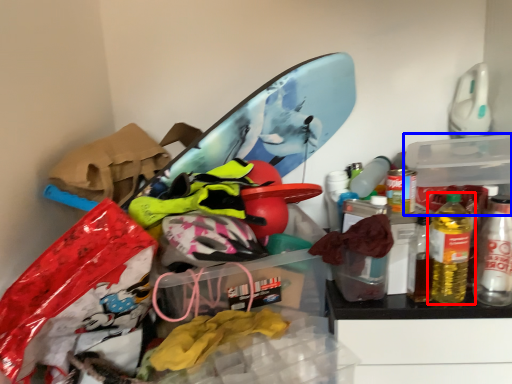
Question: Which object is further to the camera taking this photo, bottle (highlighted by a red box) or storage box (highlighted by a blue box)?

Choices:
 (A) bottle
 (B) storage box

Answer: (B)